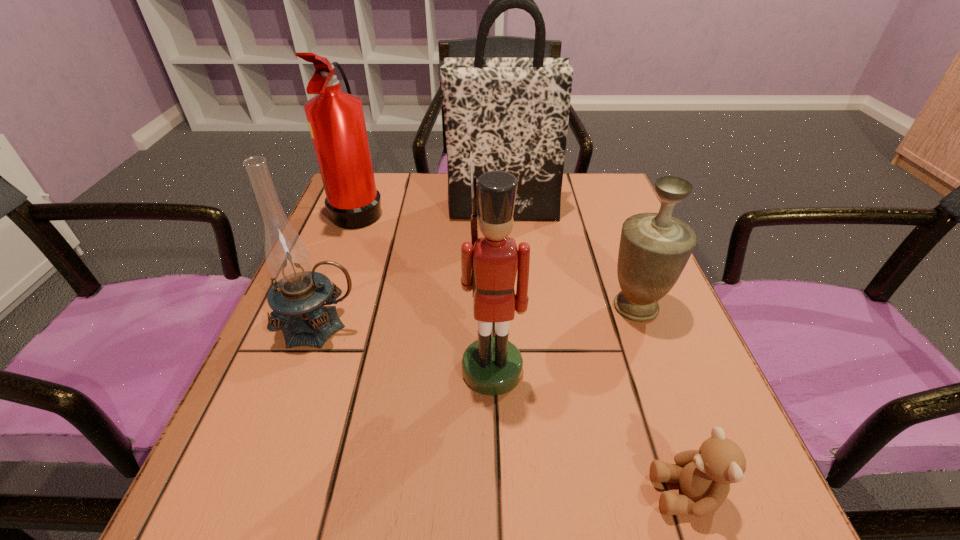
Identify which object is located as the second nearest to the nearest object. Please provide its 2D coordinates. Your answer should be formatted as a tuple, i.e. [(x, y)], where the tuple contains the x and y coordinates of a point satisfying the conditions above.

[(654, 248)]

Locate an element on the screen. This screenshot has height=540, width=960. free spot that satisfies the following two spatial constraints: 1. at the spray nozzle of the fire extinguisher; 2. on the left side of the urn is located at coordinates (322, 307).

Locate an element on the screen. This screenshot has width=960, height=540. free space that satisfies the following two spatial constraints: 1. at the spray nozzle of the second shortest object; 2. on the right side of the fire extinguisher is located at coordinates (322, 307).

I want to click on free point that satisfies the following two spatial constraints: 1. on the front of the shopping bag with the design; 2. at the spray nozzle of the fire extinguisher, so click(x=502, y=210).

Identify the location of vacant space that satisfies the following two spatial constraints: 1. at the spray nozzle of the fire extinguisher; 2. on the left side of the fifth tallest object. Image resolution: width=960 pixels, height=540 pixels. (322, 307).